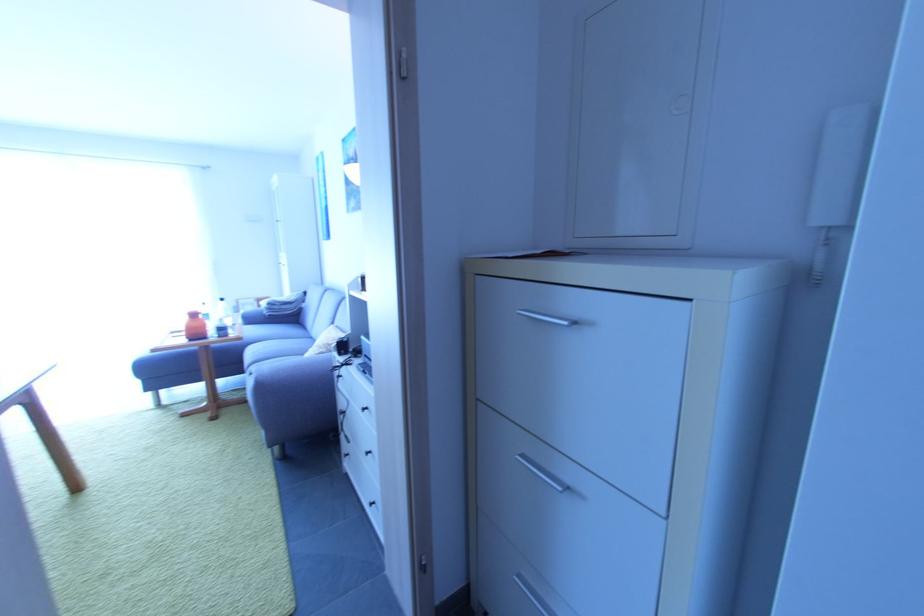
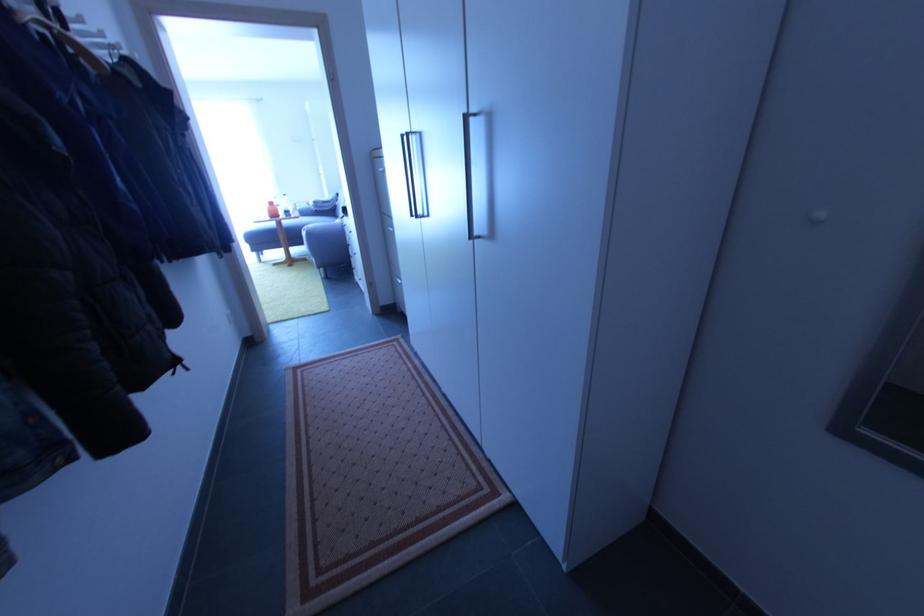
Find the pixel in the second image that matches point (199, 317) in the first image.

(275, 205)